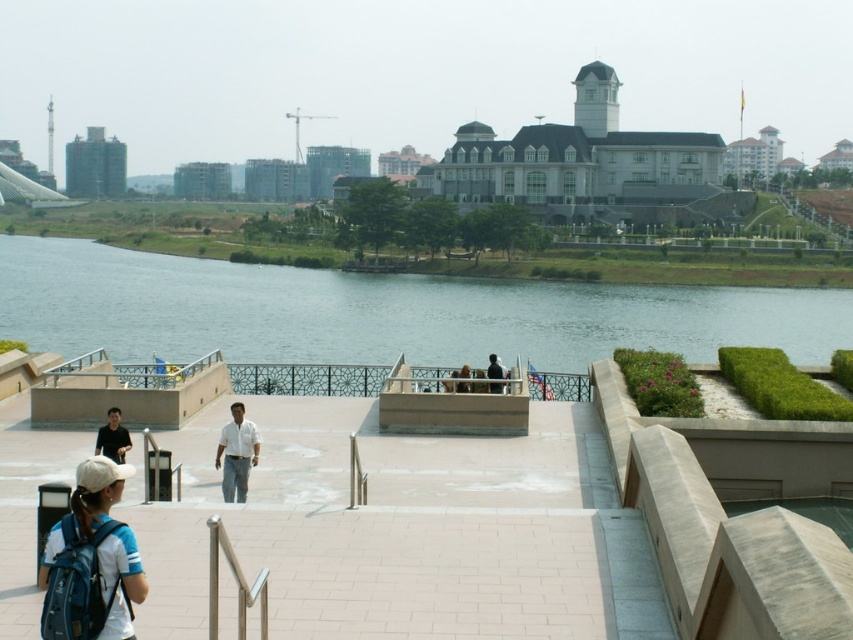
Is blue fabric backpack at lower left shorter than black matte shirt at lower left?

In fact, blue fabric backpack at lower left may be taller than black matte shirt at lower left.

Based on the photo, between blue fabric backpack at lower left and black matte shirt at lower left, which one has less height?

black matte shirt at lower left

Which is in front, point (109, 628) or point (106, 436)?

Point (109, 628)

In order to click on blue fabric backpack at lower left in this screenshot , I will do `click(84, 509)`.

Can you confirm if blue water at center is positioned to the left of black matte jacket at center?

Yes, blue water at center is to the left of black matte jacket at center.

Can you confirm if blue water at center is bigger than black matte jacket at center?

Indeed, blue water at center has a larger size compared to black matte jacket at center.

Which is behind, point (433, 301) or point (488, 371)?

The point (433, 301) is behind.

The height and width of the screenshot is (640, 853). I want to click on blue water at center, so click(381, 312).

Is blue fabric backpack at lower left below black matte jacket at center?

Yes, blue fabric backpack at lower left is below black matte jacket at center.

Is point (126, 618) in front of point (488, 369)?

Yes, point (126, 618) is closer to viewer.

Is point (42, 580) positioned after point (486, 376)?

No, (42, 580) is closer to viewer.

Locate an element on the screen. The width and height of the screenshot is (853, 640). blue fabric backpack at lower left is located at coordinates (84, 509).